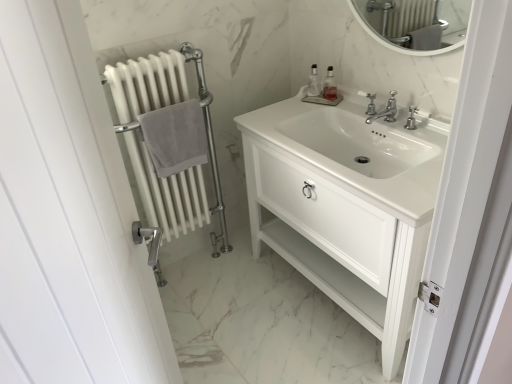
What do you see at coordinates (359, 151) in the screenshot?
I see `white glossy sink at center` at bounding box center [359, 151].

The height and width of the screenshot is (384, 512). Describe the element at coordinates (382, 111) in the screenshot. I see `silver metallic faucet at center` at that location.

Identify the location of white glossy cabinet at center. (x=346, y=205).

Considering the sizes of objects translucent plastic soap dispenser at upper center, the 2th soap dispenser in the left-to-right sequence, and gray cotton towel at left in the image provided, who is thinner, translucent plastic soap dispenser at upper center, the 2th soap dispenser in the left-to-right sequence, or gray cotton towel at left?

Thinner between the two is translucent plastic soap dispenser at upper center, the 2th soap dispenser in the left-to-right sequence.

Would you say translucent plastic soap dispenser at upper center, which appears as the first soap dispenser when viewed from the right, is to the left or to the right of gray cotton towel at left in the picture?

From the image, it's evident that translucent plastic soap dispenser at upper center, which appears as the first soap dispenser when viewed from the right, is to the right of gray cotton towel at left.

From a real-world perspective, who is located lower, translucent plastic soap dispenser at upper center, the 2th soap dispenser in the left-to-right sequence, or gray cotton towel at left?

gray cotton towel at left.

Between point (331, 87) and point (165, 123), which one is positioned behind?

The point (331, 87) is behind.

In the scene shown: Which object is further away from the camera, white glossy sink at center or white matte radiator at left?

white matte radiator at left is further away from the camera.

Could you tell me if white glossy sink at center is facing white matte radiator at left?

No.

From the image's perspective, which is below, white glossy sink at center or white matte radiator at left?

white matte radiator at left appears lower in the image.

Measure the distance from white glossy sink at center to white matte radiator at left.

They are 23.27 inches apart.

Looking at the image, does translucent plastic soap dispenser at upper center, the 2th soap dispenser in the left-to-right sequence, seem bigger or smaller compared to clear plastic soap dispenser at upper right, which is counted as the second soap dispenser, starting from the right?

translucent plastic soap dispenser at upper center, the 2th soap dispenser in the left-to-right sequence, is smaller than clear plastic soap dispenser at upper right, which is counted as the second soap dispenser, starting from the right.

Between translucent plastic soap dispenser at upper center, the 2th soap dispenser in the left-to-right sequence, and clear plastic soap dispenser at upper right, which is counted as the second soap dispenser, starting from the right, which one appears on the left side from the viewer's perspective?

clear plastic soap dispenser at upper right, which is counted as the second soap dispenser, starting from the right, is more to the left.

From the image's perspective, does translucent plastic soap dispenser at upper center, which appears as the first soap dispenser when viewed from the right, appear higher than clear plastic soap dispenser at upper right, marked as the first soap dispenser in a left-to-right arrangement?

No, from the image's perspective, translucent plastic soap dispenser at upper center, which appears as the first soap dispenser when viewed from the right, is not above clear plastic soap dispenser at upper right, marked as the first soap dispenser in a left-to-right arrangement.

Is translucent plastic soap dispenser at upper center, which appears as the first soap dispenser when viewed from the right, oriented towards clear plastic soap dispenser at upper right, marked as the first soap dispenser in a left-to-right arrangement?

No, translucent plastic soap dispenser at upper center, which appears as the first soap dispenser when viewed from the right, is not facing towards clear plastic soap dispenser at upper right, marked as the first soap dispenser in a left-to-right arrangement.

Would you say white glossy sink at center is a long distance from translucent plastic soap dispenser at upper center, which appears as the first soap dispenser when viewed from the right?

No, white glossy sink at center is not far from translucent plastic soap dispenser at upper center, which appears as the first soap dispenser when viewed from the right.

In the scene shown: Is white glossy sink at center in front of translucent plastic soap dispenser at upper center, which appears as the first soap dispenser when viewed from the right?

Yes, white glossy sink at center is closer to the camera.

Looking at this image, is white glossy sink at center facing away from translucent plastic soap dispenser at upper center, the 2th soap dispenser in the left-to-right sequence?

white glossy sink at center is not turned away from translucent plastic soap dispenser at upper center, the 2th soap dispenser in the left-to-right sequence.

Who is smaller, white glossy sink at center or translucent plastic soap dispenser at upper center, which appears as the first soap dispenser when viewed from the right?

translucent plastic soap dispenser at upper center, which appears as the first soap dispenser when viewed from the right.

Do you think white matte radiator at left is within translucent plastic soap dispenser at upper center, which appears as the first soap dispenser when viewed from the right, or outside of it?

The correct answer is: outside.

In terms of height, does white matte radiator at left look taller or shorter compared to translucent plastic soap dispenser at upper center, the 2th soap dispenser in the left-to-right sequence?

Clearly, white matte radiator at left is taller compared to translucent plastic soap dispenser at upper center, the 2th soap dispenser in the left-to-right sequence.

In terms of size, does white matte radiator at left appear bigger or smaller than translucent plastic soap dispenser at upper center, which appears as the first soap dispenser when viewed from the right?

Clearly, white matte radiator at left is larger in size than translucent plastic soap dispenser at upper center, which appears as the first soap dispenser when viewed from the right.

Based on the photo, are white matte radiator at left and translucent plastic soap dispenser at upper center, the 2th soap dispenser in the left-to-right sequence, beside each other?

No, white matte radiator at left is not next to translucent plastic soap dispenser at upper center, the 2th soap dispenser in the left-to-right sequence.

Considering the positions of objects white glossy cabinet at center and white matte radiator at left in the image provided, who is behind, white glossy cabinet at center or white matte radiator at left?

white matte radiator at left.

Is point (433, 184) farther from camera compared to point (192, 168)?

No, it is in front of (192, 168).

From the image's perspective, is white glossy cabinet at center above or below white matte radiator at left?

From the image's perspective, white glossy cabinet at center appears below white matte radiator at left.

At what (x,y) coordinates should I click in order to perform the action: click on bathroom cabinet below the white matte radiator at left (from a real-world perspective). Please return your answer as a coordinate pair (x, y). The image size is (512, 384). Looking at the image, I should click on point(346,205).

Is white matte radiator at left inside or outside of white glossy cabinet at center?

white matte radiator at left is not inside white glossy cabinet at center, it's outside.

Can you confirm if white matte radiator at left is thinner than white glossy cabinet at center?

Yes, white matte radiator at left is thinner than white glossy cabinet at center.

From the image's perspective, count 1st soap dispensers upward from the gray cotton towel at left and point to it. Please provide its 2D coordinates.

[(329, 86)]

Where is `sink on the right of white matte radiator at left`? Image resolution: width=512 pixels, height=384 pixels. sink on the right of white matte radiator at left is located at coordinates (359, 151).

From the picture: Based on their spatial positions, is white glossy sink at center or white glossy cabinet at center closer to translucent plastic soap dispenser at upper center, the 2th soap dispenser in the left-to-right sequence?

The object closer to translucent plastic soap dispenser at upper center, the 2th soap dispenser in the left-to-right sequence, is white glossy sink at center.

From the image, which object appears to be farther from white glossy cabinet at center, translucent plastic soap dispenser at upper center, which appears as the first soap dispenser when viewed from the right, or white matte radiator at left?

Among the two, translucent plastic soap dispenser at upper center, which appears as the first soap dispenser when viewed from the right, is located further to white glossy cabinet at center.

When comparing their distances from translucent plastic soap dispenser at upper center, which appears as the first soap dispenser when viewed from the right, does white glossy cabinet at center or white glossy sink at center seem further?

white glossy cabinet at center is positioned further to the anchor translucent plastic soap dispenser at upper center, which appears as the first soap dispenser when viewed from the right.

Looking at the image, which one is located closer to silver metallic faucet at center, white glossy sink at center or translucent plastic soap dispenser at upper center, the 2th soap dispenser in the left-to-right sequence?

translucent plastic soap dispenser at upper center, the 2th soap dispenser in the left-to-right sequence, is positioned closer to the anchor silver metallic faucet at center.

Considering their positions, is white matte radiator at left positioned closer to clear plastic soap dispenser at upper right, which is counted as the second soap dispenser, starting from the right, than translucent plastic soap dispenser at upper center, the 2th soap dispenser in the left-to-right sequence?

The object closer to clear plastic soap dispenser at upper right, which is counted as the second soap dispenser, starting from the right, is translucent plastic soap dispenser at upper center, the 2th soap dispenser in the left-to-right sequence.

Looking at this image, when comparing their distances from gray cotton towel at left, does white glossy sink at center or white glossy cabinet at center seem closer?

Among the two, white glossy sink at center is located nearer to gray cotton towel at left.

Looking at the image, which one is located further to gray cotton towel at left, translucent plastic soap dispenser at upper center, which appears as the first soap dispenser when viewed from the right, or white matte radiator at left?

Based on the image, translucent plastic soap dispenser at upper center, which appears as the first soap dispenser when viewed from the right, appears to be further to gray cotton towel at left.

When comparing their distances from white matte radiator at left, does silver metallic faucet at center or clear plastic soap dispenser at upper right, which is counted as the second soap dispenser, starting from the right, seem closer?

clear plastic soap dispenser at upper right, which is counted as the second soap dispenser, starting from the right.

You are a GUI agent. You are given a task and a screenshot of the screen. Output one action in this format:
    pyautogui.click(x=<x>, y=<y>)
    Task: Click on the tap between white glossy cabinet at center and translucent plastic soap dispenser at upper center, which appears as the first soap dispenser when viewed from the right, from front to back
    Image resolution: width=512 pixels, height=384 pixels.
    Given the screenshot: What is the action you would take?
    pyautogui.click(x=382, y=111)

Find the location of `soap dispenser located between white glossy cabinet at center and clear plastic soap dispenser at upper right, which is counted as the second soap dispenser, starting from the right, in the depth direction`. soap dispenser located between white glossy cabinet at center and clear plastic soap dispenser at upper right, which is counted as the second soap dispenser, starting from the right, in the depth direction is located at coordinates (329, 86).

This screenshot has width=512, height=384. I want to click on bath towel situated between white matte radiator at left and white glossy cabinet at center from left to right, so click(175, 137).

Locate an element on the screen. bath towel between white matte radiator at left and clear plastic soap dispenser at upper right, marked as the first soap dispenser in a left-to-right arrangement, in the horizontal direction is located at coordinates (175, 137).